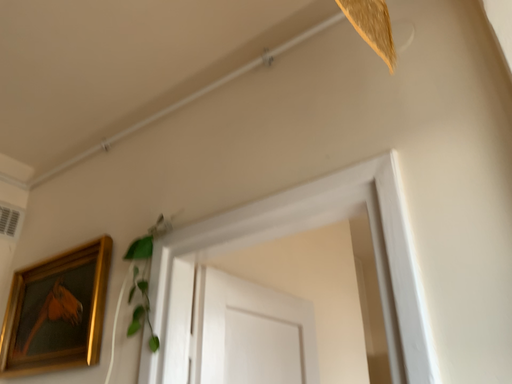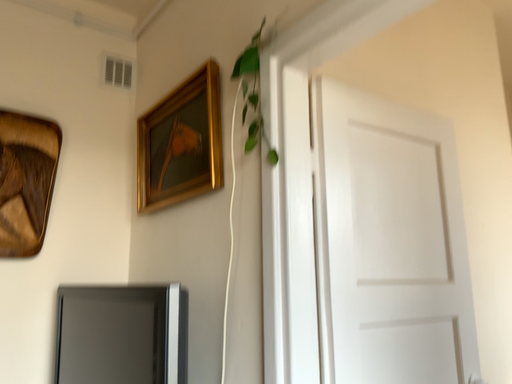
Question: Which way did the camera rotate in the video?

Choices:
 (A) rotated left
 (B) rotated right

Answer: (A)